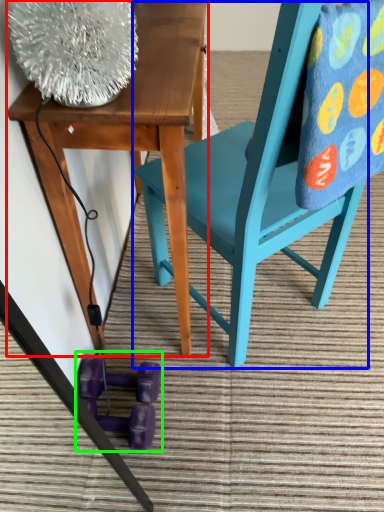
Question: Estimate the real-world distances between objects in this image. Which object is closer to table (highlighted by a red box), chair (highlighted by a blue box) or toy (highlighted by a green box)?

Choices:
 (A) chair
 (B) toy

Answer: (A)